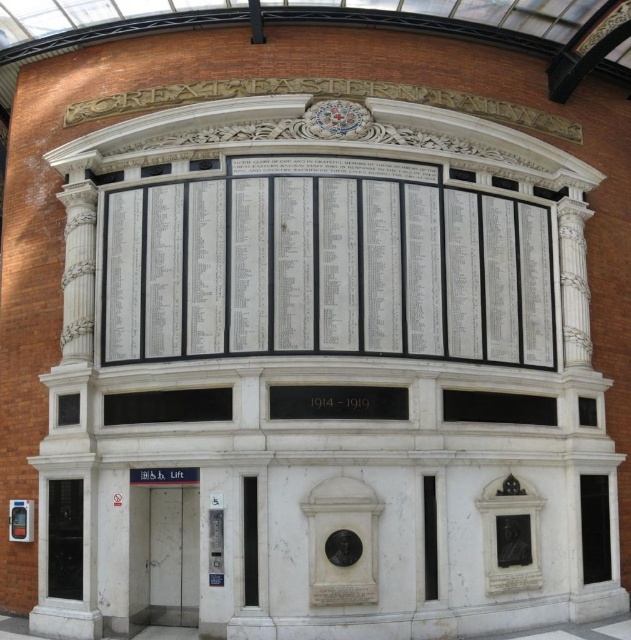
Question: Which object is positioned farthest from the transparent glass window at lower right?

Choices:
 (A) white marble pillar at lower left
 (B) white marble memorial at center
 (C) black glass window at center
 (D) black marble plaque at center

Answer: (A)

Question: Can you confirm if white marble memorial at center is positioned below transparent glass window at lower right?

Choices:
 (A) yes
 (B) no

Answer: (B)

Question: Does white marble memorial at center come behind white marble pillar at lower left?

Choices:
 (A) no
 (B) yes

Answer: (B)

Question: Can you confirm if white marble pillar at lower left is bigger than transparent glass window at lower right?

Choices:
 (A) no
 (B) yes

Answer: (B)

Question: Among these objects, which one is nearest to the camera?

Choices:
 (A) white marble pillar at lower left
 (B) white marble memorial at center
 (C) black marble plaque at center

Answer: (A)

Question: Estimate the real-world distances between objects in this image. Which object is farther from the transparent glass window at lower right?

Choices:
 (A) black marble window at lower center
 (B) black glass window at center

Answer: (A)